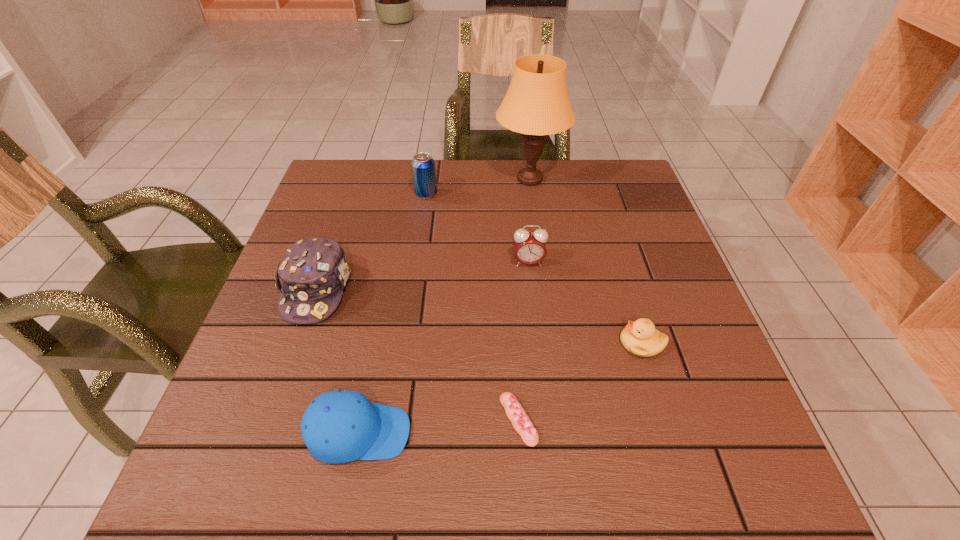
The width and height of the screenshot is (960, 540). Identify the location of cap present at the near edge. (340, 426).

Find the location of a particular element. Image resolution: width=960 pixels, height=540 pixels. eclair situated at the near edge is located at coordinates (516, 414).

This screenshot has height=540, width=960. Identify the location of object present at the right edge. (640, 338).

I want to click on object positioned at the near left corner, so click(340, 426).

This screenshot has height=540, width=960. In the image, there is a desktop. What are the coordinates of `vacant space at the far edge` in the screenshot? It's located at (543, 207).

Where is `free space at the near edge of the desktop`? The image size is (960, 540). free space at the near edge of the desktop is located at coordinates point(617,475).

Where is `vacant space at the left edge`? The width and height of the screenshot is (960, 540). vacant space at the left edge is located at coordinates (345, 232).

In the image, there is a desktop. Where is `vacant space at the right edge`? This screenshot has height=540, width=960. vacant space at the right edge is located at coordinates (676, 282).

At what (x,y) coordinates should I click in order to perform the action: click on free space at the near left corner. Please return your answer as a coordinate pair (x, y). The width and height of the screenshot is (960, 540). Looking at the image, I should click on (194, 492).

Image resolution: width=960 pixels, height=540 pixels. In the image, there is a desktop. What are the coordinates of `vacant space at the far right corner` in the screenshot? It's located at (623, 179).